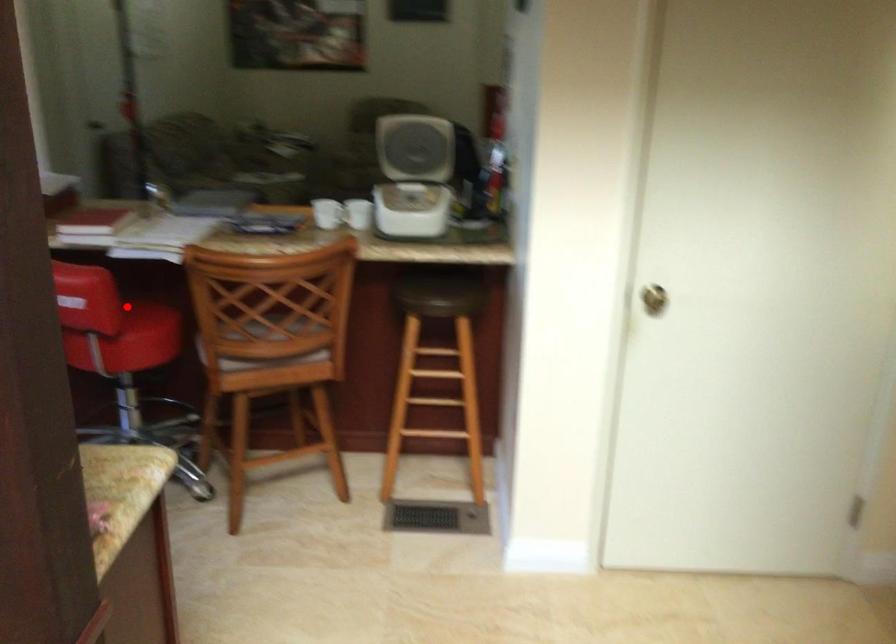
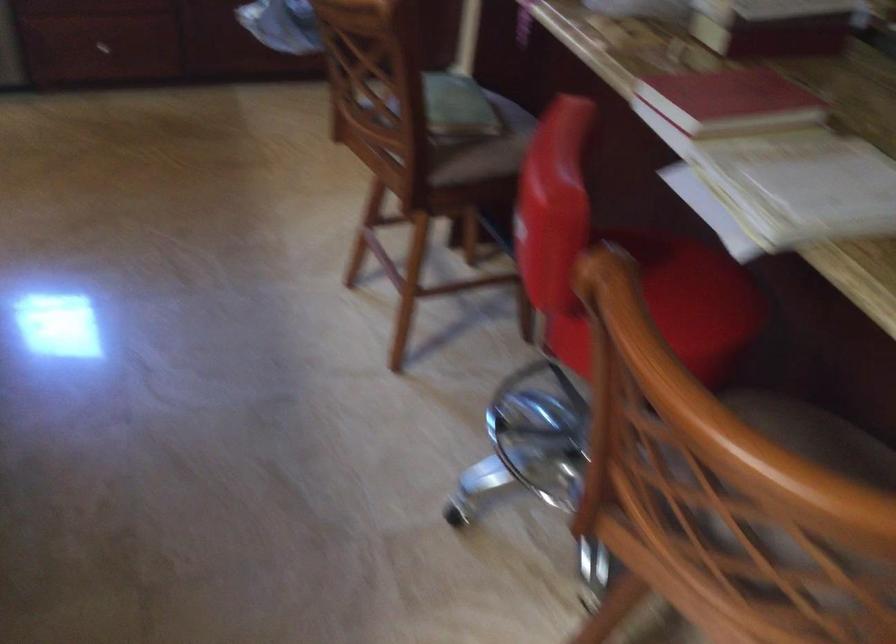
Locate, in the second image, the point that corresponds to the highlighted location in the first image.

(669, 279)